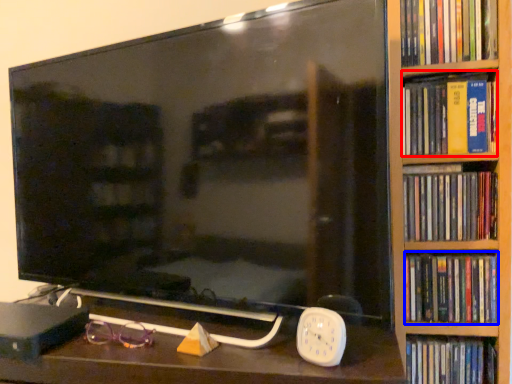
Question: Which of the following is the farthest to the observer, book (highlighted by a red box) or book (highlighted by a blue box)?

Choices:
 (A) book
 (B) book

Answer: (B)